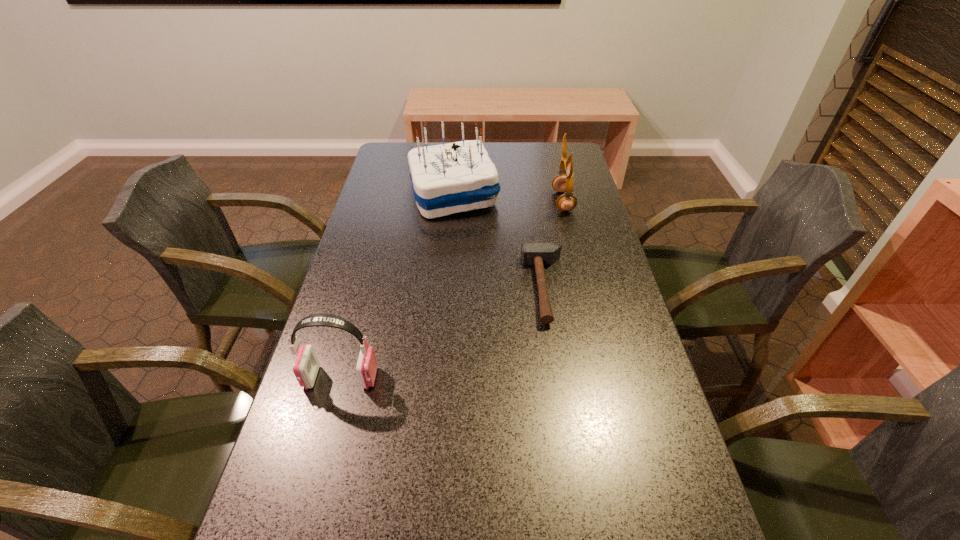
The image size is (960, 540). In order to click on vacant area situated 0.330m on the front-facing side of the farther earphone in this screenshot , I will do `click(454, 201)`.

At what (x,y) coordinates should I click in order to perform the action: click on free spot located on the outer surface of the nearer earphone. Please return your answer as a coordinate pair (x, y). The width and height of the screenshot is (960, 540). Looking at the image, I should click on (540, 377).

What are the coordinates of `blank space located 0.200m on the striking surface of the shortest object` in the screenshot? It's located at (448, 288).

Locate an element on the screen. free spot located on the striking surface of the shortest object is located at coordinates [419, 288].

The width and height of the screenshot is (960, 540). What are the coordinates of `free location located on the striking surface of the shortest object` in the screenshot? It's located at (464, 288).

This screenshot has height=540, width=960. I want to click on object located at the far edge, so click(x=456, y=177).

The width and height of the screenshot is (960, 540). What are the coordinates of `birthday cake located at the left edge` in the screenshot? It's located at (456, 177).

Identify the location of earphone that is positioned at the left edge. The height and width of the screenshot is (540, 960). (306, 365).

You are a GUI agent. You are given a task and a screenshot of the screen. Output one action in this format:
    pyautogui.click(x=<x>, y=<y>)
    Task: Click on the earphone at the right edge
    The width and height of the screenshot is (960, 540).
    Given the screenshot: What is the action you would take?
    pyautogui.click(x=562, y=183)

The image size is (960, 540). Find the location of `hammer at the right edge`. hammer at the right edge is located at coordinates 539,254.